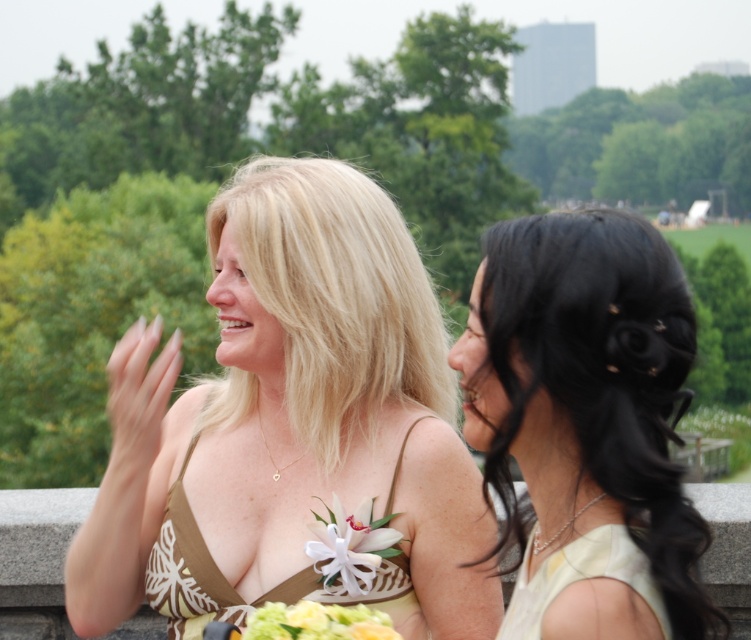
Question: Can you confirm if matte gold dress at center is positioned above black shiny hair at right?

Choices:
 (A) yes
 (B) no

Answer: (A)

Question: Which object is the closest to the white fabric flower at center?

Choices:
 (A) white satin dress at lower right
 (B) matte gold dress at center

Answer: (B)

Question: Is brown printed fabric dress at center closer to camera compared to floral bouquet at center?

Choices:
 (A) yes
 (B) no

Answer: (B)

Question: Observing the image, what is the correct spatial positioning of matte gold dress at center in reference to black shiny hair at right?

Choices:
 (A) above
 (B) below

Answer: (A)

Question: Which object is closer to the camera taking this photo?

Choices:
 (A) matte gold dress at center
 (B) floral bouquet at center

Answer: (B)

Question: Based on their relative distances, which object is nearer to the white fabric flower at center?

Choices:
 (A) floral bouquet at center
 (B) matte gold dress at center
 (C) white satin dress at lower right

Answer: (B)